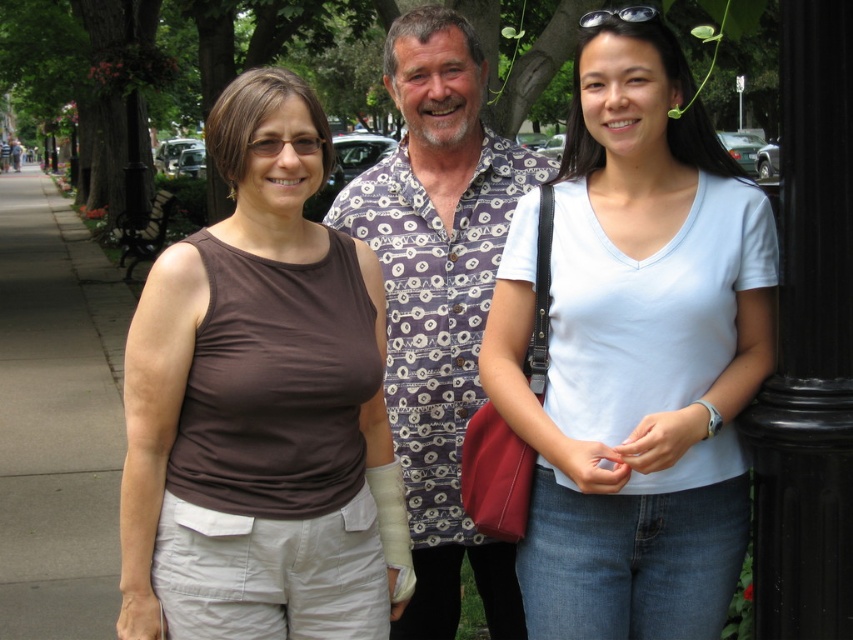
You are standing at the point labeled point (218, 116) and want to walk towards the point labeled point (45, 524). Given that both points are on the sidewalk, which direction should you face to move towards your destination?

Since point (218, 116) is closer to the camera than point 0.819, 054, you should face away from the camera to move towards point 0.819, 054.

You are standing at the point marked by coordinates point (636, 353). Looking around, you see a light blue cotton shirt at center. Which direction should you face to see the light blue cotton shirt at center?

Since you are already at the point marked by coordinates point (636, 353), you are directly facing the light blue cotton shirt at center, so you should face forward to see it.